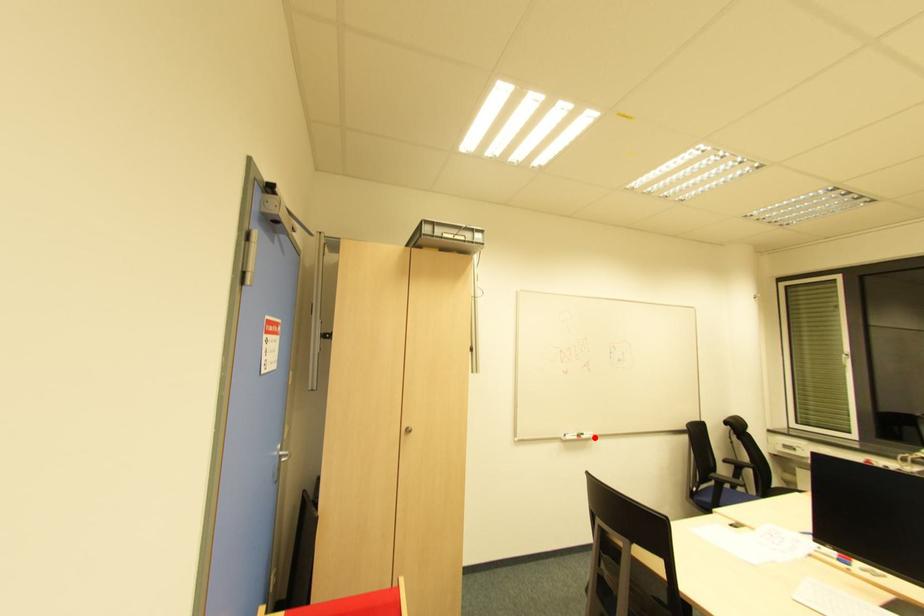
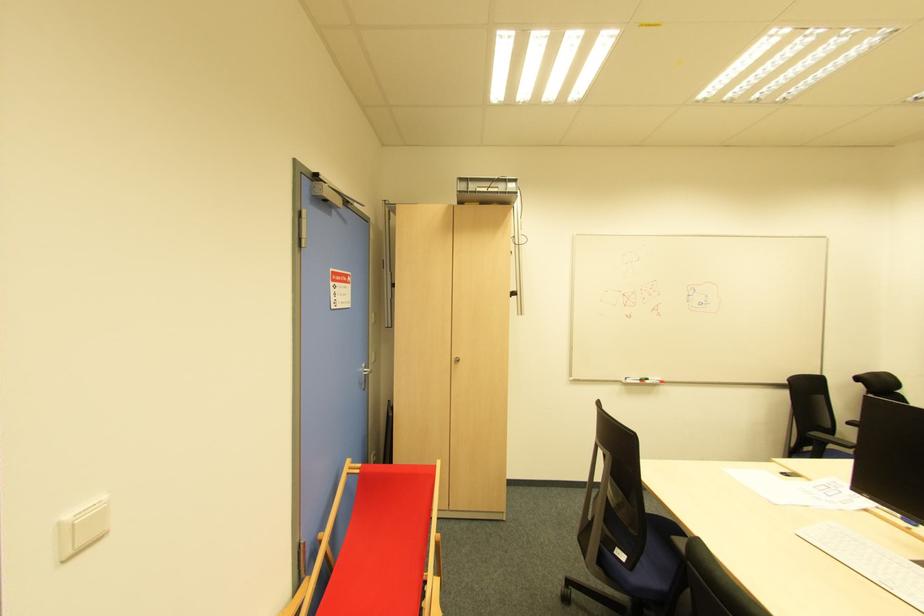
Locate, in the second image, the point that corresponds to the highlighted location in the first image.

(662, 383)